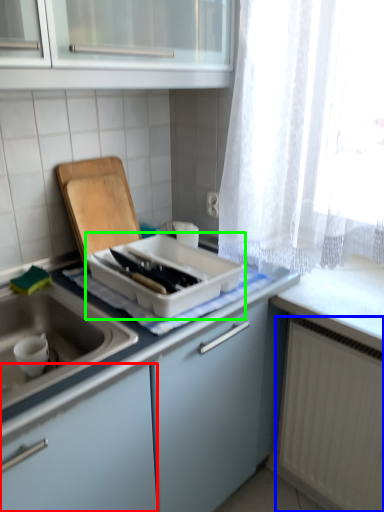
Question: Considering the real-world distances, which object is farthest from cabinetry (highlighted by a red box)? radiator (highlighted by a blue box) or kitchen appliance (highlighted by a green box)?

Choices:
 (A) radiator
 (B) kitchen appliance

Answer: (A)